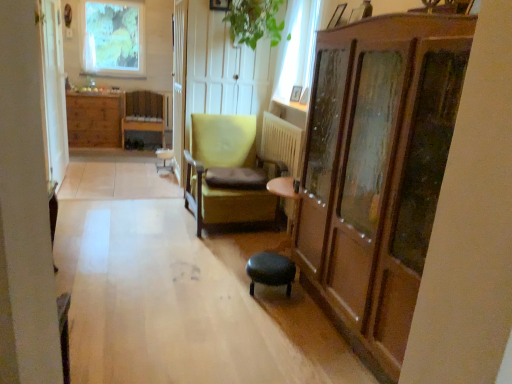
Question: Does green matte window at upper left, the 1th window in the top-to-bottom sequence, have a greater width compared to black leather stool at center?

Choices:
 (A) no
 (B) yes

Answer: (A)

Question: From a real-world perspective, is green matte window at upper left, which is counted as the 2th window, starting from the bottom, over black leather stool at center?

Choices:
 (A) no
 (B) yes

Answer: (B)

Question: Can you confirm if green matte window at upper left, the 1th window in the top-to-bottom sequence, is positioned to the left of black leather stool at center?

Choices:
 (A) yes
 (B) no

Answer: (A)

Question: Can you confirm if green matte window at upper left, which is counted as the 2th window, starting from the bottom, is positioned to the right of black leather stool at center?

Choices:
 (A) no
 (B) yes

Answer: (A)

Question: Is green matte window at upper left, positioned as the second window in right-to-left order, in front of black leather stool at center?

Choices:
 (A) no
 (B) yes

Answer: (A)

Question: From the image's perspective, is green matte window at upper left, positioned as the second window in right-to-left order, under black leather stool at center?

Choices:
 (A) yes
 (B) no

Answer: (B)

Question: Can you confirm if black leather stool at center is positioned to the left of wooden picture frame at upper center, marked as the first picture frame in a top-to-bottom arrangement?

Choices:
 (A) yes
 (B) no

Answer: (B)

Question: Does black leather stool at center have a larger size compared to wooden picture frame at upper center, which ranks as the second picture frame in back-to-front order?

Choices:
 (A) no
 (B) yes

Answer: (B)

Question: Is black leather stool at center not close to wooden picture frame at upper center, acting as the third picture frame starting from the bottom?

Choices:
 (A) yes
 (B) no

Answer: (A)

Question: Does black leather stool at center have a smaller size compared to wooden picture frame at upper center, acting as the third picture frame starting from the bottom?

Choices:
 (A) yes
 (B) no

Answer: (B)

Question: Could you tell me if black leather stool at center is turned towards wooden picture frame at upper center, which ranks as the second picture frame in back-to-front order?

Choices:
 (A) yes
 (B) no

Answer: (B)

Question: Is black leather stool at center directly adjacent to wooden picture frame at upper center, which is counted as the second picture frame, starting from the front?

Choices:
 (A) no
 (B) yes

Answer: (A)

Question: Is matte yellow armchair at center, positioned as the 1th chair in bottom-to-top order, inside metallic silver picture frame at upper right, the 2th picture frame positioned from the bottom?

Choices:
 (A) yes
 (B) no

Answer: (B)